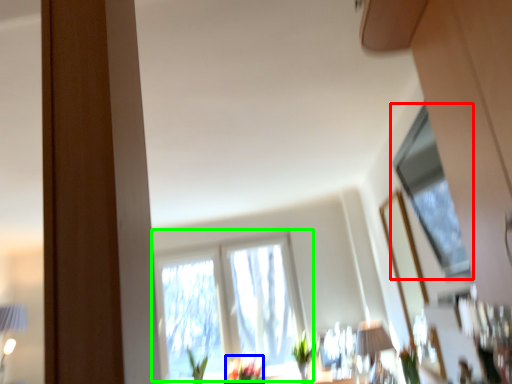
Question: Based on their relative distances, which object is farther from window (highlighted by a red box)? Choose from flower (highlighted by a blue box) and window (highlighted by a green box).

Choices:
 (A) flower
 (B) window

Answer: (A)